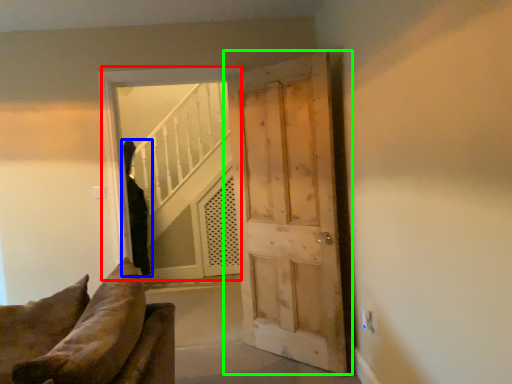
Question: Based on their relative distances, which object is farther from window (highlighted by a red box)? Choose from person (highlighted by a blue box) and door (highlighted by a green box).

Choices:
 (A) person
 (B) door

Answer: (A)